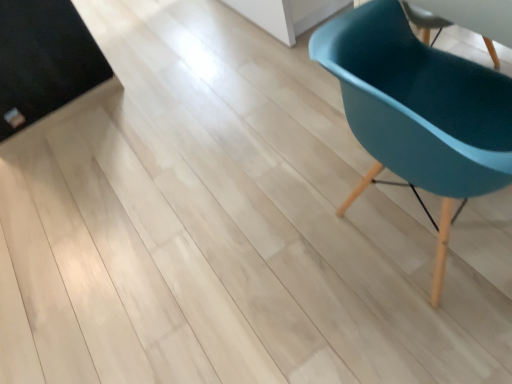
This screenshot has width=512, height=384. Find the location of `vacant space behind teal plastic chair at right`. vacant space behind teal plastic chair at right is located at coordinates (303, 143).